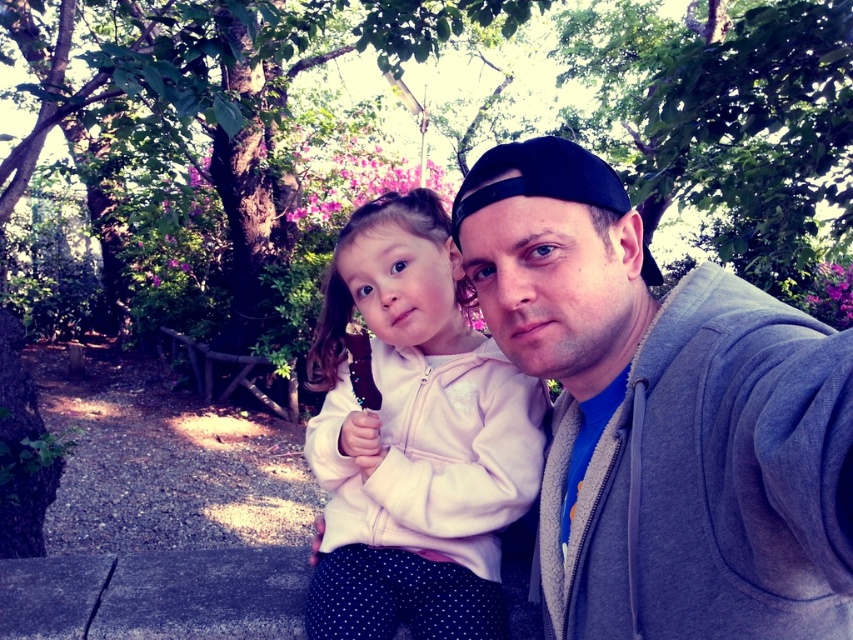
Question: Which point is farther to the camera?

Choices:
 (A) (461, 400)
 (B) (647, 609)

Answer: (A)

Question: Which of the following is the closest to the observer?

Choices:
 (A) (387, 461)
 (B) (584, 573)

Answer: (B)

Question: Can you confirm if gray fleece jacket at center is positioned to the left of white fleece jacket at center?

Choices:
 (A) no
 (B) yes

Answer: (A)

Question: Can you confirm if gray fleece jacket at center is positioned above white fleece jacket at center?

Choices:
 (A) no
 (B) yes

Answer: (B)

Question: Does gray fleece jacket at center have a lesser width compared to white fleece jacket at center?

Choices:
 (A) no
 (B) yes

Answer: (B)